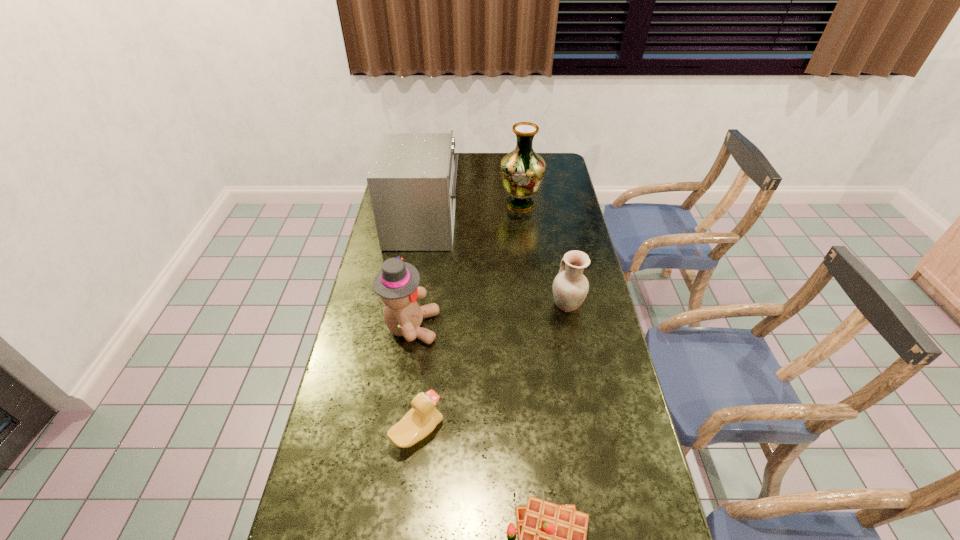
Where is `vacant space in between the vase and the rag_doll`? vacant space in between the vase and the rag_doll is located at coordinates point(466,265).

This screenshot has width=960, height=540. Find the location of `blank region between the toaster oven and the vase`. blank region between the toaster oven and the vase is located at coordinates pyautogui.click(x=471, y=214).

Find the location of a particular element. empty space between the vase and the third tallest object is located at coordinates pyautogui.click(x=466, y=265).

The width and height of the screenshot is (960, 540). In order to click on blank region between the third shortest object and the vase in this screenshot , I will do (x=543, y=254).

Where is `empty location between the rag_doll and the vase`? The width and height of the screenshot is (960, 540). empty location between the rag_doll and the vase is located at coordinates (466, 265).

I want to click on object that is the third closest to the pottery, so click(x=522, y=171).

This screenshot has height=540, width=960. Identify the location of the closest object to the fifth farthest object. (397, 282).

At what (x,y) coordinates should I click in order to perform the action: click on free space in the image that satisfies the following two spatial constraints: 1. on the front panel of the fourth tallest object; 2. on the right side of the toaster oven. Please return your answer as a coordinate pair (x, y). This screenshot has height=540, width=960. Looking at the image, I should click on (411, 304).

Where is `vacant region that satisfies the following two spatial constraints: 1. on the front panel of the toaster oven; 2. on the left side of the pottery`? vacant region that satisfies the following two spatial constraints: 1. on the front panel of the toaster oven; 2. on the left side of the pottery is located at coordinates (411, 304).

Find the location of `free space in the image that satisfies the following two spatial constraints: 1. on the front panel of the toaster oven; 2. on the back side of the third shortest object`. free space in the image that satisfies the following two spatial constraints: 1. on the front panel of the toaster oven; 2. on the back side of the third shortest object is located at coordinates (411, 304).